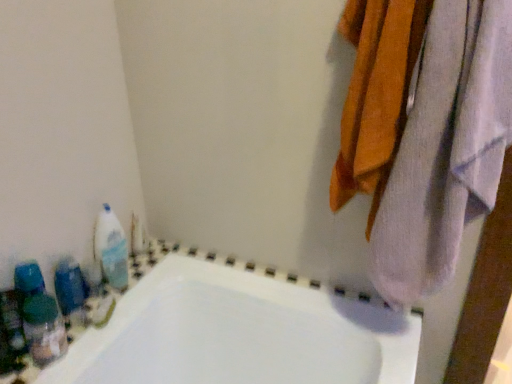
Question: From the image's perspective, would you say white soft towel at upper right is positioned over white glossy bottle at left, arranged as the second cleaning product when viewed from the front?

Choices:
 (A) yes
 (B) no

Answer: (A)

Question: From the image's perspective, is white soft towel at upper right under white glossy bottle at left, the 2th cleaning product positioned from the bottom?

Choices:
 (A) no
 (B) yes

Answer: (A)

Question: Is white soft towel at upper right wider than white glossy bottle at left, marked as the 1th cleaning product in a back-to-front arrangement?

Choices:
 (A) yes
 (B) no

Answer: (A)

Question: Considering the relative positions of white soft towel at upper right and white glossy bottle at left, arranged as the second cleaning product when viewed from the front, in the image provided, is white soft towel at upper right to the right of white glossy bottle at left, arranged as the second cleaning product when viewed from the front, from the viewer's perspective?

Choices:
 (A) no
 (B) yes

Answer: (B)

Question: Is white soft towel at upper right closer to camera compared to white glossy bottle at left, placed as the first cleaning product when sorted from top to bottom?

Choices:
 (A) no
 (B) yes

Answer: (B)

Question: Is white glossy bottle at left, arranged as the second cleaning product when viewed from the front, at the back of white soft towel at upper right?

Choices:
 (A) no
 (B) yes

Answer: (A)

Question: Is white soft towel at upper right smaller than blue plastic bottles at left?

Choices:
 (A) no
 (B) yes

Answer: (A)

Question: From a real-world perspective, is white soft towel at upper right located higher than blue plastic bottles at left?

Choices:
 (A) yes
 (B) no

Answer: (A)

Question: Is blue plastic bottles at left located within white soft towel at upper right?

Choices:
 (A) yes
 (B) no

Answer: (B)

Question: Would you say white soft towel at upper right is a long distance from blue plastic bottles at left?

Choices:
 (A) yes
 (B) no

Answer: (B)

Question: Is white soft towel at upper right looking in the opposite direction of blue plastic bottles at left?

Choices:
 (A) no
 (B) yes

Answer: (A)

Question: Can you confirm if white soft towel at upper right is bigger than blue plastic bottles at left?

Choices:
 (A) yes
 (B) no

Answer: (A)

Question: Can you confirm if white glossy bottle at left, placed as the first cleaning product when sorted from top to bottom, is positioned to the left of blue plastic bottles at left?

Choices:
 (A) yes
 (B) no

Answer: (B)